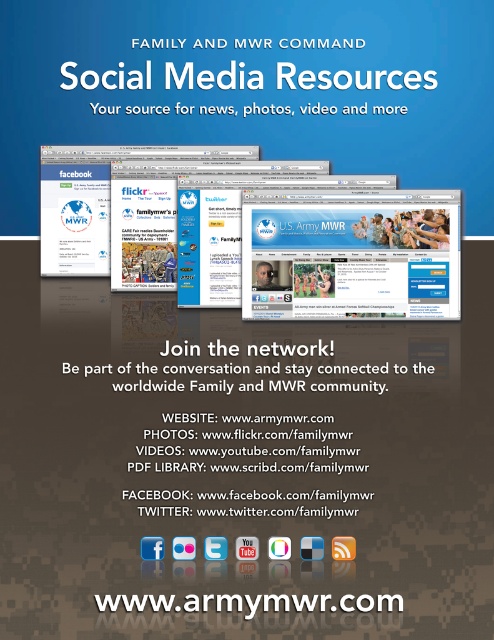
Question: Which of the following is the closest to the observer?

Choices:
 (A) blue glossy computer screen at center
 (B) white paper at center

Answer: (B)

Question: Among these points, which one is farthest from the camera?

Choices:
 (A) (59, 436)
 (B) (126, 608)

Answer: (A)

Question: Considering the relative positions of blue glossy computer screen at center and white text on brown website at bottom in the image provided, where is blue glossy computer screen at center located with respect to white text on brown website at bottom?

Choices:
 (A) left
 (B) right

Answer: (B)

Question: From the image, what is the correct spatial relationship of white paper at center in relation to white text on brown website at bottom?

Choices:
 (A) right
 (B) left

Answer: (A)

Question: Does blue glossy computer screen at center appear over white text on brown website at bottom?

Choices:
 (A) yes
 (B) no

Answer: (A)

Question: Which object appears closest to the camera in this image?

Choices:
 (A) white text on brown website at bottom
 (B) blue glossy computer screen at center
 (C) white paper at center

Answer: (A)